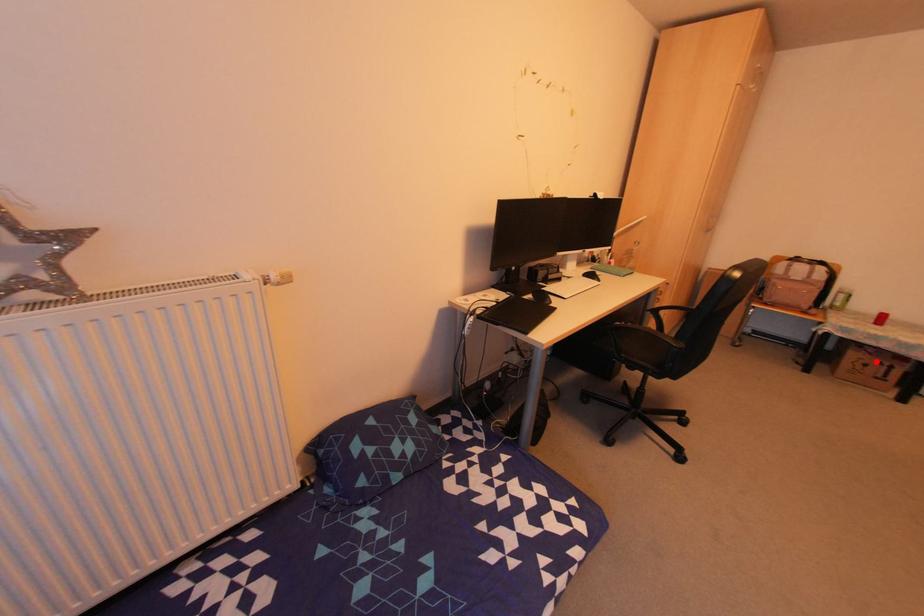
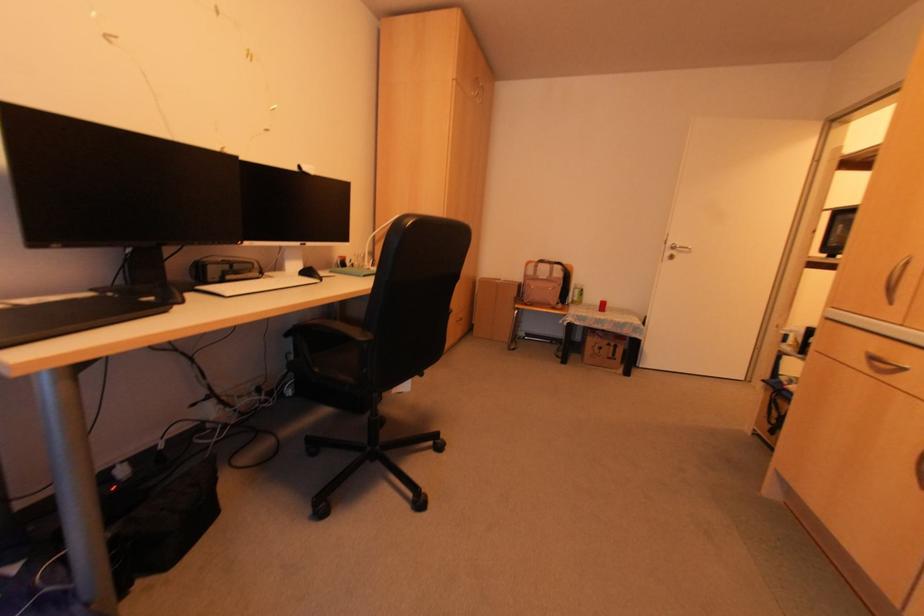
Question: I am providing you with two images of the same scene from different viewpoints. Image1 has a red point marked. In image2, the corresponding 3D location appears at what relative position? Reply with the corresponding letter.

Choices:
 (A) Closer
 (B) Farther

Answer: (A)